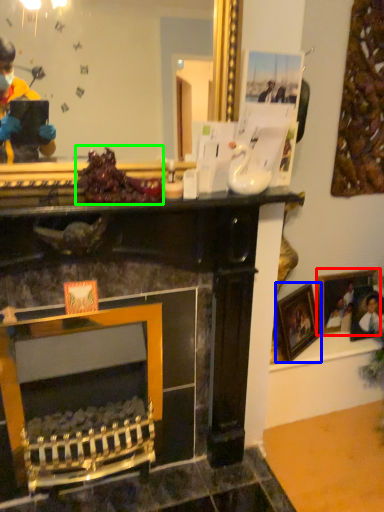
Question: Based on their relative distances, which object is farther from picture frame (highlighted by a red box)? Choose from picture frame (highlighted by a blue box) and food (highlighted by a green box).

Choices:
 (A) picture frame
 (B) food

Answer: (B)